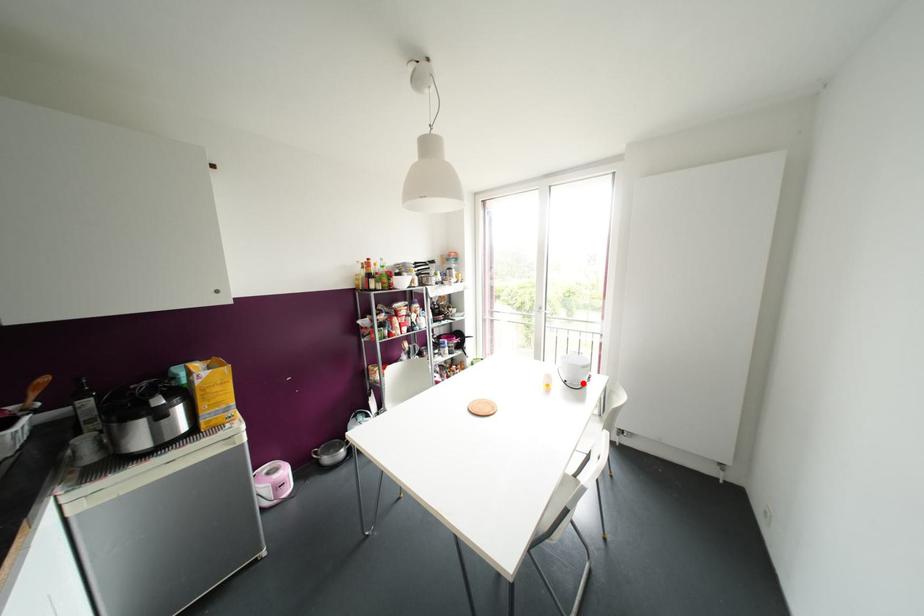
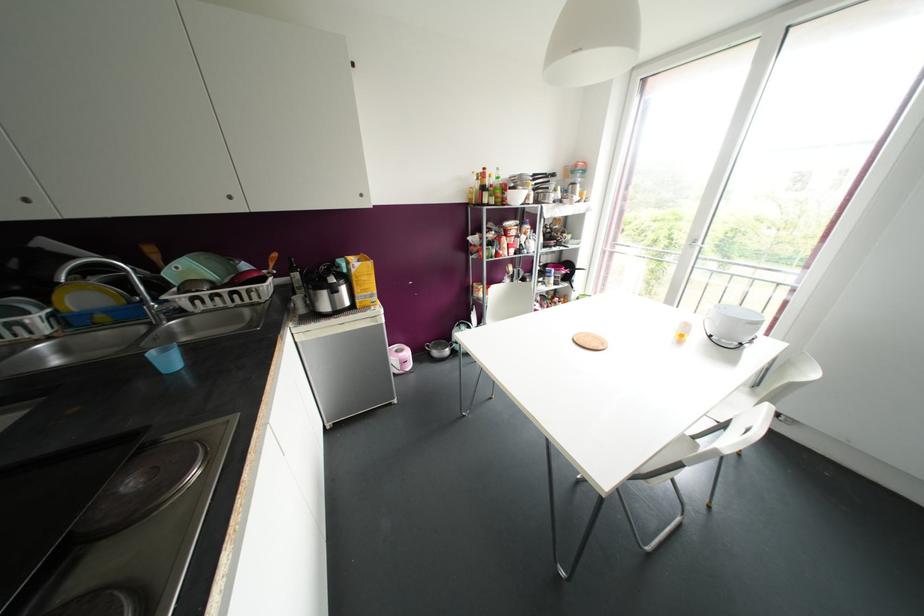
The point at the highlighted location is marked in the first image. Where is the corresponding point in the second image?

(740, 342)